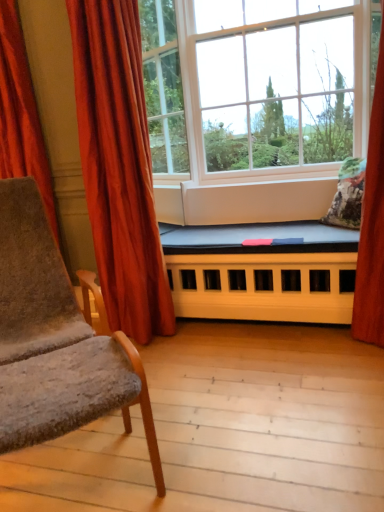
Question: Does white plastic window at center, placed as the first window when sorted from right to left, have a lesser height compared to velvet gray armchair at left?

Choices:
 (A) yes
 (B) no

Answer: (B)

Question: Can you confirm if white plastic window at center, placed as the first window when sorted from right to left, is taller than velvet gray armchair at left?

Choices:
 (A) yes
 (B) no

Answer: (A)

Question: Is white plastic window at center, the second window in the left-to-right sequence, facing away from velvet gray armchair at left?

Choices:
 (A) yes
 (B) no

Answer: (B)

Question: Is white plastic window at center, the second window in the left-to-right sequence, positioned in front of velvet gray armchair at left?

Choices:
 (A) no
 (B) yes

Answer: (A)

Question: Could velvet gray armchair at left be considered to be inside white plastic window at center, placed as the first window when sorted from right to left?

Choices:
 (A) no
 (B) yes

Answer: (A)

Question: Would you say velvet red curtain at left, placed as the 2th curtain when sorted from right to left, is to the left or to the right of fluffy floral pillow at right in the picture?

Choices:
 (A) left
 (B) right

Answer: (A)

Question: In the image, is velvet red curtain at left, which is counted as the 1th curtain, starting from the left, positioned in front of or behind fluffy floral pillow at right?

Choices:
 (A) behind
 (B) front

Answer: (B)

Question: Is velvet red curtain at left, placed as the 2th curtain when sorted from right to left, wider or thinner than fluffy floral pillow at right?

Choices:
 (A) wide
 (B) thin

Answer: (B)

Question: Is velvet red curtain at left, placed as the 2th curtain when sorted from right to left, spatially inside fluffy floral pillow at right, or outside of it?

Choices:
 (A) outside
 (B) inside

Answer: (A)

Question: Relative to white plastic window at center, the second window in the left-to-right sequence, is velvet gray armchair at left in front or behind?

Choices:
 (A) behind
 (B) front

Answer: (B)

Question: Is point (26, 345) positioned closer to the camera than point (180, 126)?

Choices:
 (A) farther
 (B) closer

Answer: (B)

Question: In terms of width, does velvet gray armchair at left look wider or thinner when compared to white plastic window at center, placed as the first window when sorted from right to left?

Choices:
 (A) wide
 (B) thin

Answer: (B)

Question: From a real-world perspective, is velvet gray armchair at left physically located above or below white plastic window at center, the second window in the left-to-right sequence?

Choices:
 (A) above
 (B) below

Answer: (B)

Question: Is point (x=104, y=246) positioned closer to the camera than point (x=76, y=138)?

Choices:
 (A) closer
 (B) farther

Answer: (B)

Question: Relative to velvet red curtain at left, placed as the 2th curtain when sorted from right to left, is velvet red curtain at left, the second curtain in the left-to-right sequence, in front or behind?

Choices:
 (A) front
 (B) behind

Answer: (A)